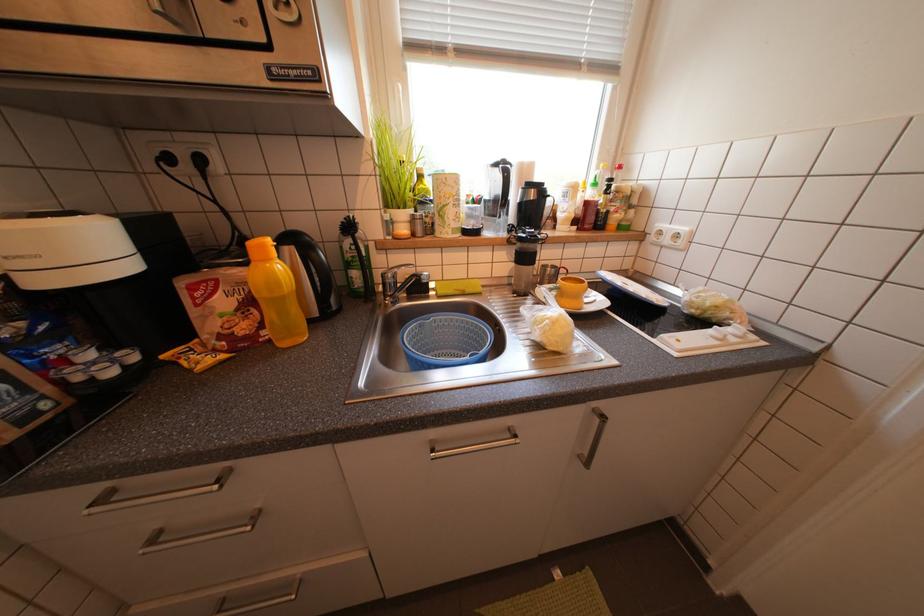
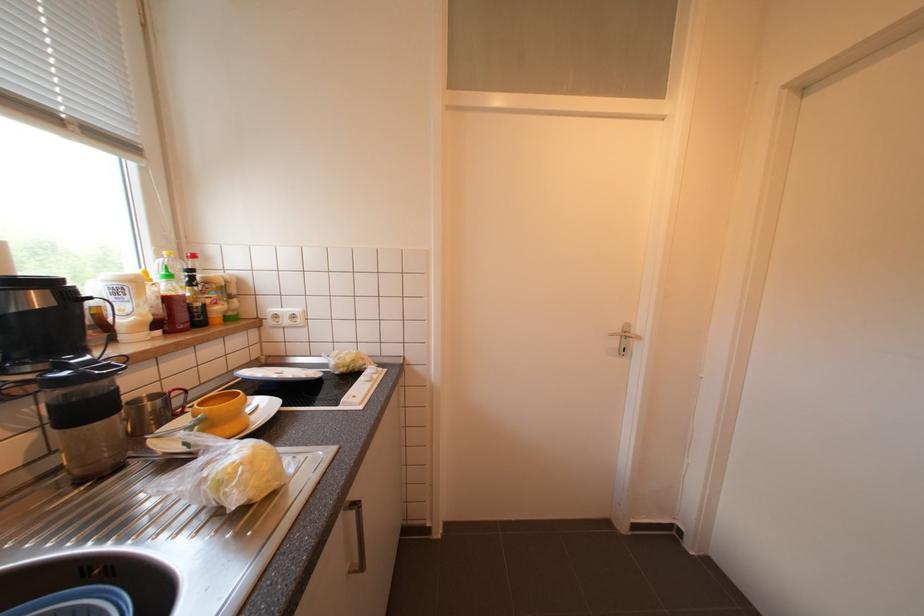
Question: How did the camera likely rotate?

Choices:
 (A) Left
 (B) Right
 (C) Up
 (D) Down

Answer: (B)